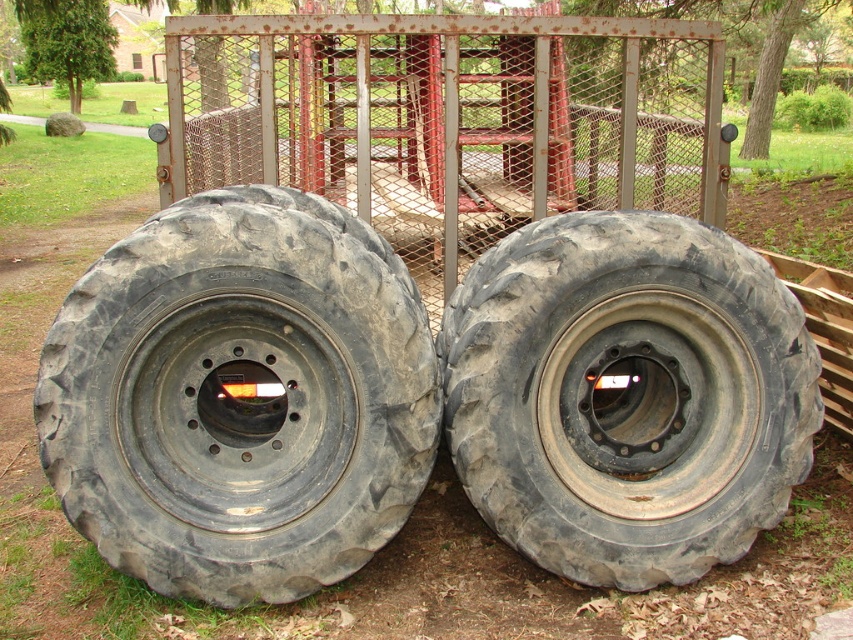
You are a delivery person trying to move a package from the metal structure with a mesh fence to the grassy area. The path is blocked by two black rubber tires. Which tire should you move first to clear the path, the black rubber tire at left or the black rubber tire at center?

The black rubber tire at left is positioned over the black rubber tire at center, so you should move the black rubber tire at left first to access the one underneath and clear the path.

You are a delivery person trying to move a box that is 3 feet wide between the black rubber tire at left and the black rubber tire at center. Can the box fit through the space between them?

The black rubber tire at left and the black rubber tire at center are 31.22 inches apart from each other. Since 3 feet is equal to 36 inches, the box is wider than the space between the tires. Therefore, the box cannot fit through the space between the black rubber tire at left and the black rubber tire at center.

You are standing at the point marked by coordinates point (241,397). You want to walk straight ahead. Which object from the scene will you encounter first, the black rubber tire at left or the metal structure in the background?

The black rubber tire at left is represented by point (241,397), so you are standing directly on it. Therefore, you are already in contact with the black rubber tire at left and do not need to walk further to encounter it. The metal structure in the background is farther away.